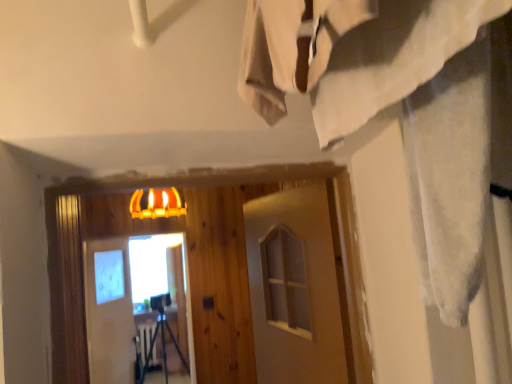
Question: Should I look upward or downward to see matte glass screen door at center?

Choices:
 (A) up
 (B) down

Answer: (B)

Question: Which direction should I rotate to face white matte barn door at center, which is counted as the first barn door, starting from the right, — up or down?

Choices:
 (A) up
 (B) down

Answer: (B)

Question: From the image's perspective, would you say white matte barn door at center, which ranks as the first barn door in back-to-front order, is positioned over matte glass screen door at center?

Choices:
 (A) yes
 (B) no

Answer: (B)

Question: Is white matte barn door at center, which ranks as the first barn door in back-to-front order, aimed at matte glass screen door at center?

Choices:
 (A) yes
 (B) no

Answer: (A)

Question: Is white matte barn door at center, which is the 2th barn door in right-to-left order, looking in the opposite direction of matte glass screen door at center?

Choices:
 (A) no
 (B) yes

Answer: (A)

Question: Does white matte barn door at center, the 1th barn door in the left-to-right sequence, appear on the left side of matte glass screen door at center?

Choices:
 (A) yes
 (B) no

Answer: (A)

Question: Considering the relative sizes of white matte barn door at center, the 2th barn door viewed from the front, and matte glass screen door at center in the image provided, is white matte barn door at center, the 2th barn door viewed from the front, bigger than matte glass screen door at center?

Choices:
 (A) yes
 (B) no

Answer: (A)

Question: From the image's perspective, is white matte barn door at center, the 2th barn door viewed from the front, below matte glass screen door at center?

Choices:
 (A) no
 (B) yes

Answer: (B)

Question: Is white matte barn door at center, which is counted as the first barn door, starting from the right, directly adjacent to matte glass screen door at center?

Choices:
 (A) yes
 (B) no

Answer: (B)

Question: Is white matte barn door at center, which appears as the second barn door when viewed from the back, aimed at matte glass screen door at center?

Choices:
 (A) no
 (B) yes

Answer: (A)

Question: Considering the relative sizes of white matte barn door at center, which appears as the second barn door when viewed from the back, and matte glass screen door at center in the image provided, is white matte barn door at center, which appears as the second barn door when viewed from the back, taller than matte glass screen door at center?

Choices:
 (A) no
 (B) yes

Answer: (A)

Question: Does white matte barn door at center, which is counted as the first barn door, starting from the right, have a lesser width compared to matte glass screen door at center?

Choices:
 (A) yes
 (B) no

Answer: (A)

Question: Is white matte barn door at center, marked as the 2th barn door in a left-to-right arrangement, positioned far away from matte glass screen door at center?

Choices:
 (A) yes
 (B) no

Answer: (A)

Question: From a real-world perspective, is white matte barn door at center, which is counted as the first barn door, starting from the right, on top of matte glass screen door at center?

Choices:
 (A) yes
 (B) no

Answer: (A)

Question: Is white matte barn door at center, positioned as the 1th barn door in front-to-back order, at the left side of white matte barn door at center, the 1th barn door in the left-to-right sequence?

Choices:
 (A) no
 (B) yes

Answer: (A)